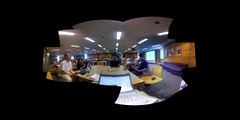
Find the location of a particular element. The width and height of the screenshot is (240, 120). table is located at coordinates (136, 78).